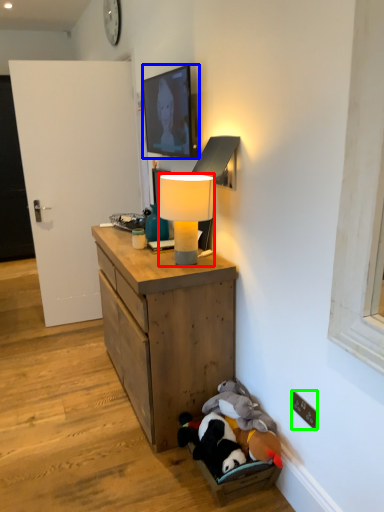
Question: Which object is positioned closest to lamp (highlighted by a red box)? Select from picture frame (highlighted by a blue box) and electric outlet (highlighted by a green box).

Choices:
 (A) picture frame
 (B) electric outlet

Answer: (A)